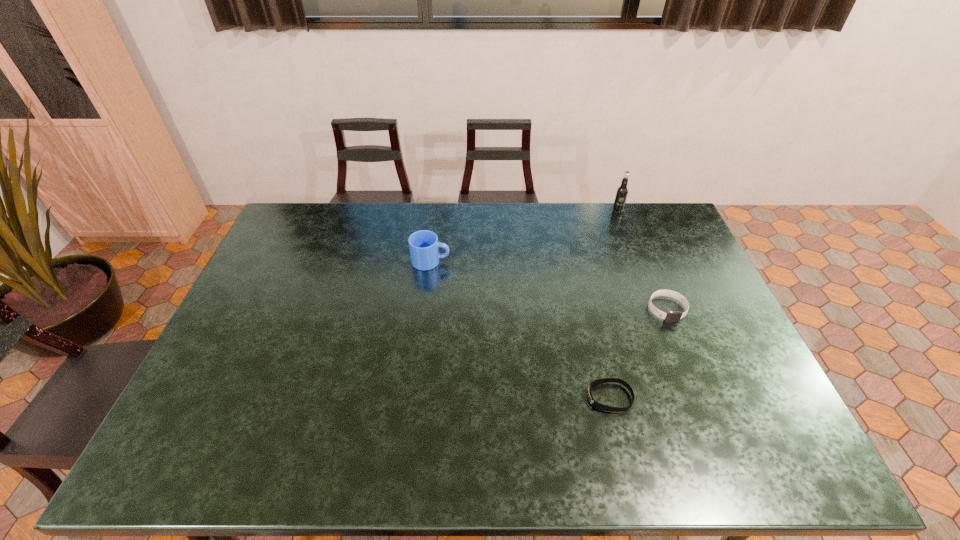
Locate an element on the screen. empty location between the farther wristband and the second farthest object is located at coordinates (549, 285).

Identify which object is the closest to the mug. Please provide its 2D coordinates. Your answer should be formatted as a tuple, i.e. [(x, y)], where the tuple contains the x and y coordinates of a point satisfying the conditions above.

[(595, 404)]

Locate an element on the screen. object that can be found as the closest to the nearest object is located at coordinates (671, 316).

Identify the location of free point that satisfies the following two spatial constraints: 1. on the label of the tallest object; 2. on the side of the third shortest object with the handle. (637, 261).

The image size is (960, 540). I want to click on vacant space that satisfies the following two spatial constraints: 1. on the label of the tallest object; 2. on the display of the second object from left to right, so click(x=689, y=397).

The height and width of the screenshot is (540, 960). What are the coordinates of `free location that satisfies the following two spatial constraints: 1. on the outer surface of the third farthest object; 2. on the display of the shorter wristband` in the screenshot? It's located at (x=703, y=397).

Find the location of `free space that satisfies the following two spatial constraints: 1. on the label of the farthest object; 2. on the display of the shortest object`. free space that satisfies the following two spatial constraints: 1. on the label of the farthest object; 2. on the display of the shortest object is located at coordinates (689, 397).

Locate an element on the screen. The width and height of the screenshot is (960, 540). free space that satisfies the following two spatial constraints: 1. on the label of the root beer; 2. on the display of the left wristband is located at coordinates point(689,397).

Locate an element on the screen. vacant space that satisfies the following two spatial constraints: 1. on the outer surface of the farther wristband; 2. on the display of the shortest object is located at coordinates (703, 397).